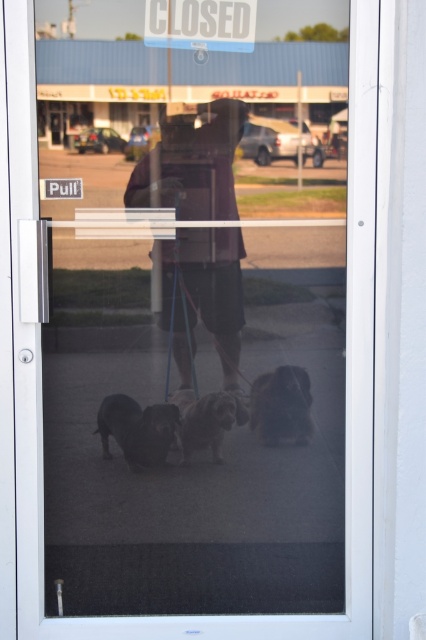
Consider the image. Does dark brown leather jacket at center appear on the right side of dark brown fur at center?

Correct, you'll find dark brown leather jacket at center to the right of dark brown fur at center.

Between dark brown leather jacket at center and dark brown fur at center, which one is positioned lower?

Positioned lower is dark brown fur at center.

Does point (238, 259) lie in front of point (106, 416)?

Yes, point (238, 259) is in front of point (106, 416).

Where is `dark brown leather jacket at center`? dark brown leather jacket at center is located at coordinates (201, 161).

Is point (190, 204) farther from camera compared to point (287, 396)?

No.

Can you confirm if dark brown leather jacket at center is positioned to the right of fluffy brown dog at center?

No, dark brown leather jacket at center is not to the right of fluffy brown dog at center.

Find the location of `dark brown leather jacket at center`. dark brown leather jacket at center is located at coordinates (201, 161).

This screenshot has width=426, height=640. Find the location of `dark brown leather jacket at center`. dark brown leather jacket at center is located at coordinates tap(201, 161).

Locate an element on the screen. The image size is (426, 640). dark brown leather jacket at center is located at coordinates (201, 161).

Which is in front, point (178, 157) or point (187, 35)?

Point (187, 35)

At what (x,y) coordinates should I click in order to perform the action: click on dark brown leather jacket at center. Please return your answer as a coordinate pair (x, y). Image resolution: width=426 pixels, height=640 pixels. Looking at the image, I should click on click(x=201, y=161).